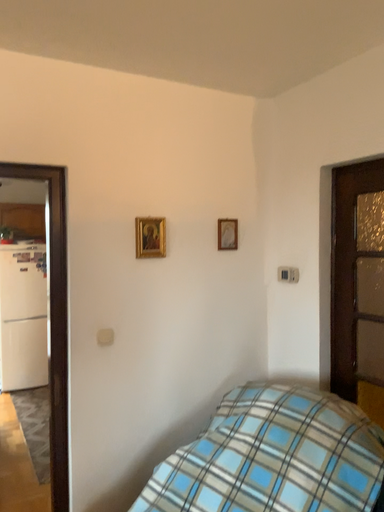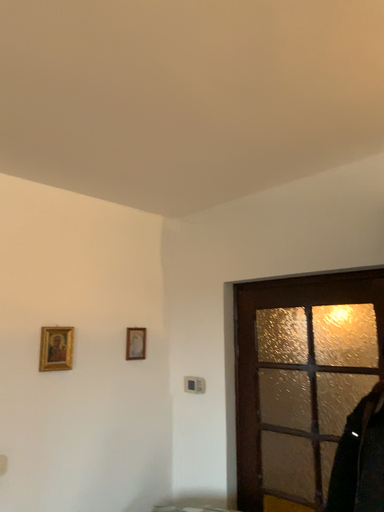
Question: How did the camera likely rotate when shooting the video?

Choices:
 (A) rotated upward
 (B) rotated downward

Answer: (A)